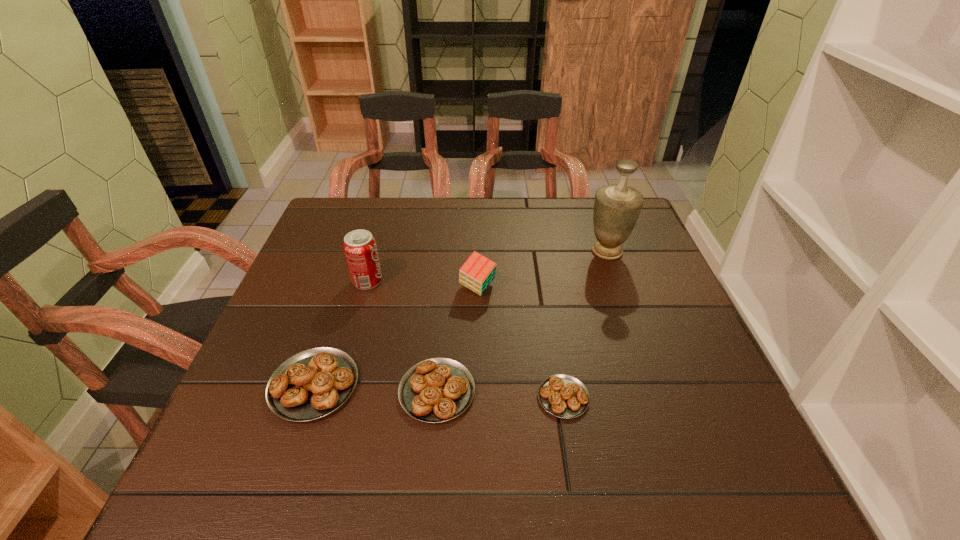
Please point a free position for a pastry on the right. Please provide its 2D coordinates. Your answer should be formatted as a tuple, i.e. [(x, y)], where the tuple contains the x and y coordinates of a point satisfying the conditions above.

[(692, 403)]